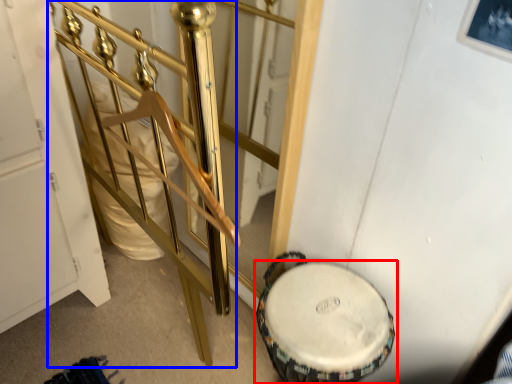
Question: Which object is closer to the camera taking this photo, drum (highlighted by a red box) or rail (highlighted by a blue box)?

Choices:
 (A) drum
 (B) rail

Answer: (B)